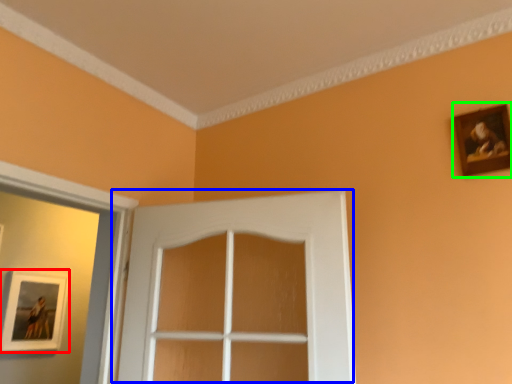
Question: Which object is positioned farthest from picture frame (highlighted by a red box)? Select from door (highlighted by a blue box) and picture frame (highlighted by a green box).

Choices:
 (A) door
 (B) picture frame

Answer: (B)